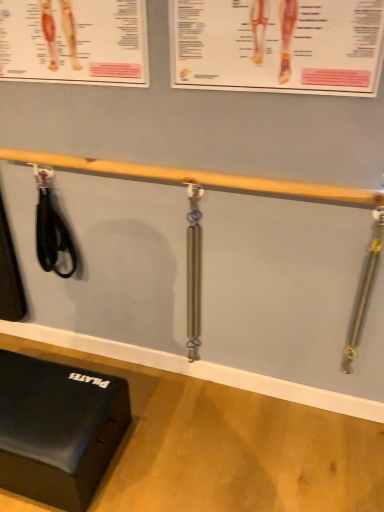
I want to click on vacant area situated below wooden beam at upper center (from a real-world perspective), so click(190, 376).